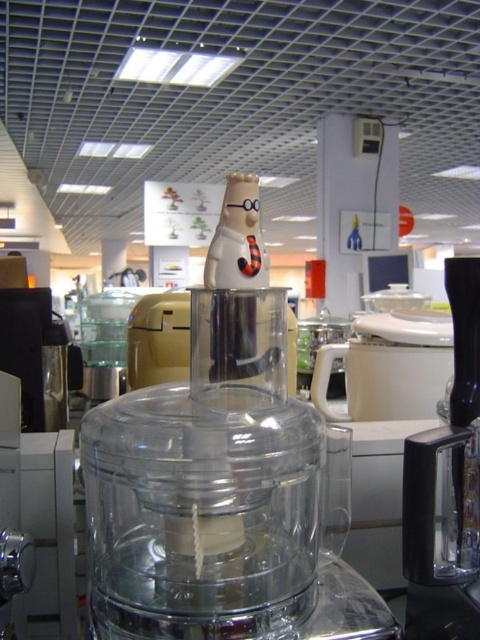
From the picture: Can you confirm if transparent plastic mixer at center is smaller than black plastic blender at center?

Incorrect, transparent plastic mixer at center is not smaller in size than black plastic blender at center.

Does point (108, 404) lie behind point (451, 627)?

No, it is not.

Locate an element on the screen. The image size is (480, 640). transparent plastic mixer at center is located at coordinates (224, 486).